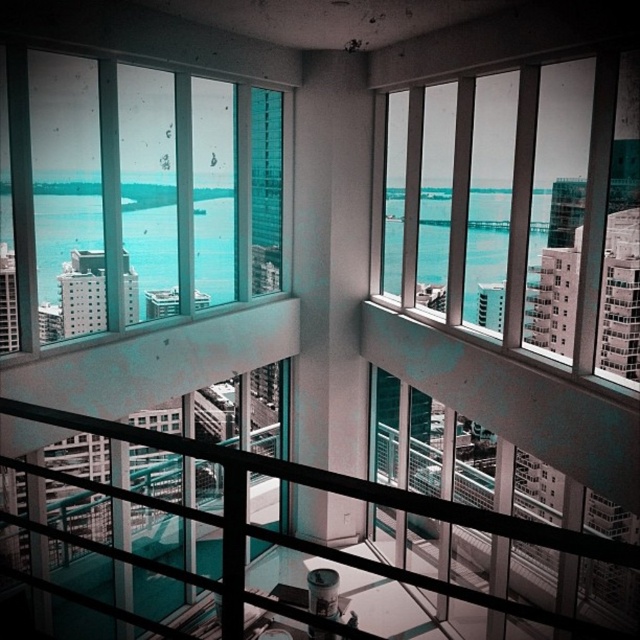
Question: Considering the real-world distances, which object is farthest from the clear glass windows at upper right?

Choices:
 (A) black metal railing at center
 (B) transparent glass window at upper left

Answer: (A)

Question: Can you confirm if clear glass windows at upper right is positioned to the right of black metal railing at center?

Choices:
 (A) no
 (B) yes

Answer: (B)

Question: Which of these objects is positioned farthest from the transparent glass window at upper left?

Choices:
 (A) clear glass windows at upper right
 (B) black metal railing at center

Answer: (B)

Question: Among these points, which one is farthest from the camera?

Choices:
 (A) (486, 282)
 (B) (636, 564)
 (C) (145, 96)

Answer: (A)

Question: Can you confirm if transparent glass window at upper left is positioned to the right of clear glass windows at upper right?

Choices:
 (A) no
 (B) yes

Answer: (A)

Question: Can you confirm if transparent glass window at upper left is thinner than clear glass windows at upper right?

Choices:
 (A) yes
 (B) no

Answer: (B)